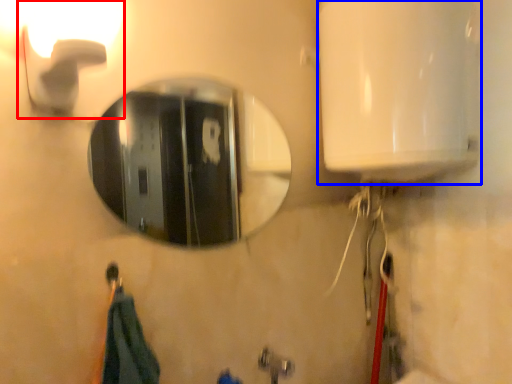
Question: Which of the following is the closest to the observer, light fixture (highlighted by a red box) or appliance (highlighted by a blue box)?

Choices:
 (A) light fixture
 (B) appliance

Answer: (A)